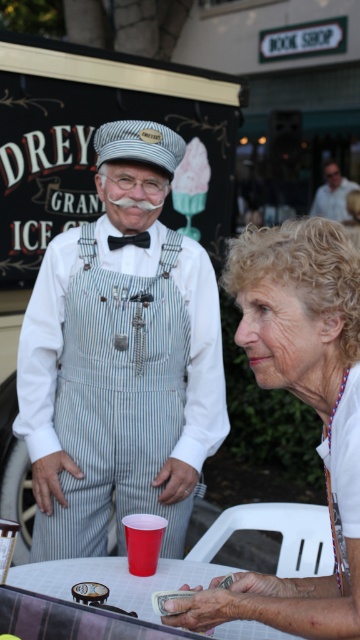
Question: Does striped cotton overalls at center come behind white fabric shirt at center?

Choices:
 (A) no
 (B) yes

Answer: (B)

Question: Which of the following is the farthest from the observer?

Choices:
 (A) striped cotton overalls at center
 (B) white fabric shirt at center
 (C) white plastic table at lower center

Answer: (A)

Question: Among these points, which one is farthest from the camera?

Choices:
 (A) (41, 584)
 (B) (357, 481)
 (C) (322, 204)
 (D) (96, 285)

Answer: (C)

Question: Which is farther from the white plastic table at lower center?

Choices:
 (A) smooth brown leather wallet at center
 (B) striped cotton overalls at center

Answer: (A)

Question: Is striped cotton overalls at center smaller than smooth brown leather wallet at center?

Choices:
 (A) no
 (B) yes

Answer: (A)

Question: From the image, what is the correct spatial relationship of white plastic table at lower center in relation to smooth brown leather wallet at center?

Choices:
 (A) below
 (B) above

Answer: (A)